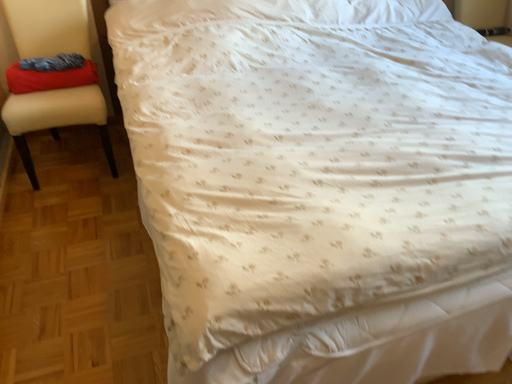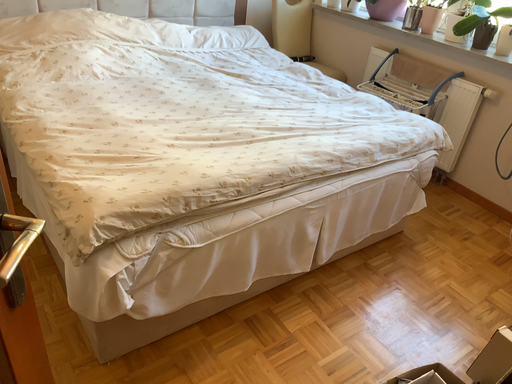
Question: Which way did the camera rotate in the video?

Choices:
 (A) rotated right
 (B) rotated left

Answer: (A)